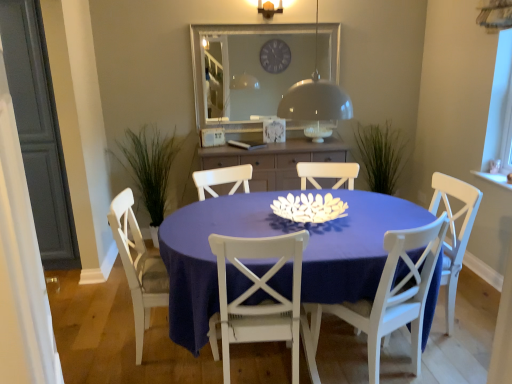
Locate an element on the screen. Image resolution: width=512 pixels, height=384 pixels. free spot above clear glass mirror at upper center (from a real-world perspective) is located at coordinates (263, 25).